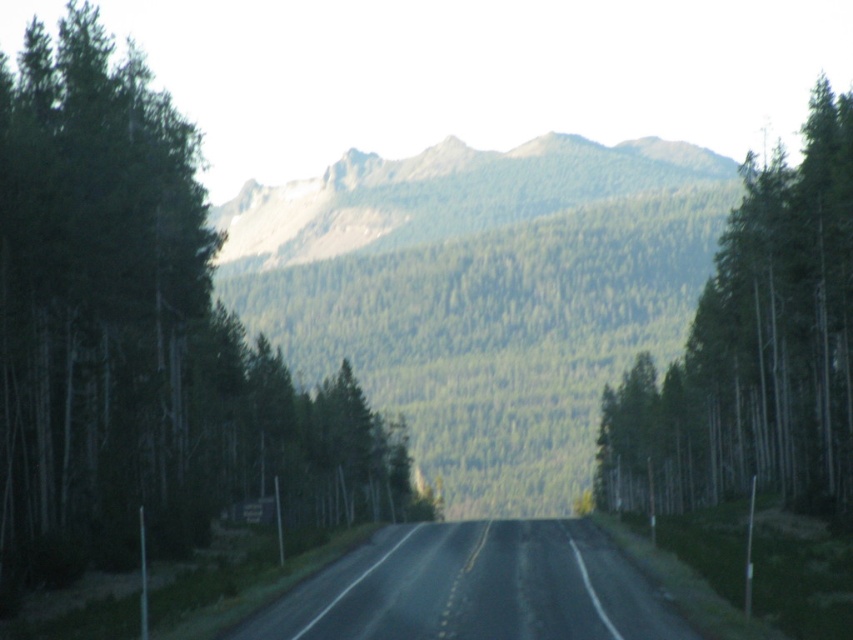
Is green textured tree at left thinner than green matte tree at right?

No, green textured tree at left is not thinner than green matte tree at right.

Does green textured tree at left lie behind green matte tree at right?

No, it is not.

Is point (99, 237) closer to camera compared to point (679, 506)?

Yes, it is.

Where is `green textured tree at left`? The height and width of the screenshot is (640, 853). green textured tree at left is located at coordinates (140, 339).

Who is taller, green textured tree at left or black asphalt road at center?

With more height is green textured tree at left.

Is the position of green textured tree at left more distant than that of black asphalt road at center?

Yes, it is.

Image resolution: width=853 pixels, height=640 pixels. Find the location of `green textured tree at left`. green textured tree at left is located at coordinates (140, 339).

Between point (486, 547) and point (223, 205), which one is positioned behind?

The point (223, 205) is more distant.

Is black asphalt road at center further to camera compared to green forested mountain at center?

No, black asphalt road at center is in front of green forested mountain at center.

Is point (577, 579) closer to viewer compared to point (376, 161)?

Yes, point (577, 579) is in front of point (376, 161).

Identify the location of black asphalt road at center. Image resolution: width=853 pixels, height=640 pixels. (474, 588).